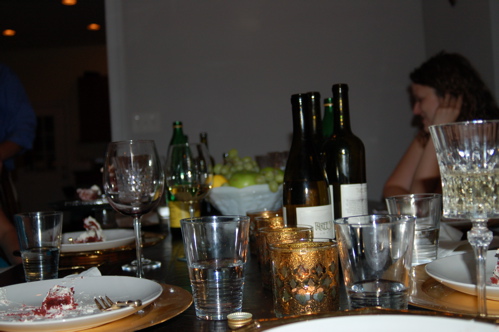
Where is `gold tea candle holder`? gold tea candle holder is located at coordinates pyautogui.click(x=277, y=229), pyautogui.click(x=264, y=213).